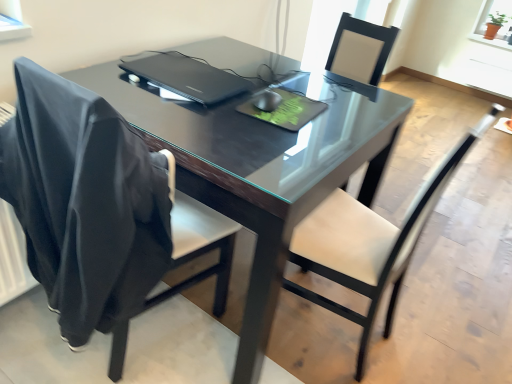
Question: Does white leather chair at center, which is the 1th chair from right to left, have a lesser width compared to black leather chair at left, which is the first chair in left-to-right order?

Choices:
 (A) yes
 (B) no

Answer: (A)

Question: From the image's perspective, would you say white leather chair at center, which is the 2th chair in left-to-right order, is shown under black leather chair at left, which is the first chair in left-to-right order?

Choices:
 (A) no
 (B) yes

Answer: (B)

Question: Does white leather chair at center, which is the 1th chair from right to left, touch black leather chair at left, the 2th chair from the right?

Choices:
 (A) no
 (B) yes

Answer: (A)

Question: Is white leather chair at center, which is the 2th chair in left-to-right order, taller than black leather chair at left, which is the first chair in left-to-right order?

Choices:
 (A) no
 (B) yes

Answer: (A)

Question: Can you confirm if white leather chair at center, which is the 1th chair from right to left, is bigger than black leather chair at left, the 2th chair from the right?

Choices:
 (A) yes
 (B) no

Answer: (B)

Question: Considering the relative sizes of white leather chair at center, which is the 1th chair from right to left, and black leather chair at left, the 2th chair from the right, in the image provided, is white leather chair at center, which is the 1th chair from right to left, wider than black leather chair at left, the 2th chair from the right,?

Choices:
 (A) yes
 (B) no

Answer: (B)

Question: Considering the relative positions of black plastic laptop at center and terracotta clay pot at upper right in the image provided, is black plastic laptop at center to the right of terracotta clay pot at upper right from the viewer's perspective?

Choices:
 (A) yes
 (B) no

Answer: (B)

Question: From the image's perspective, is black plastic laptop at center above terracotta clay pot at upper right?

Choices:
 (A) no
 (B) yes

Answer: (A)

Question: Is black plastic laptop at center smaller than terracotta clay pot at upper right?

Choices:
 (A) no
 (B) yes

Answer: (B)

Question: Can you confirm if black plastic laptop at center is shorter than terracotta clay pot at upper right?

Choices:
 (A) yes
 (B) no

Answer: (A)

Question: Is black plastic laptop at center in front of terracotta clay pot at upper right?

Choices:
 (A) yes
 (B) no

Answer: (A)

Question: Would you say black plastic laptop at center is outside terracotta clay pot at upper right?

Choices:
 (A) no
 (B) yes

Answer: (B)

Question: Is black leather chair at left, the 2th chair from the right, next to glossy black table at center?

Choices:
 (A) no
 (B) yes

Answer: (A)